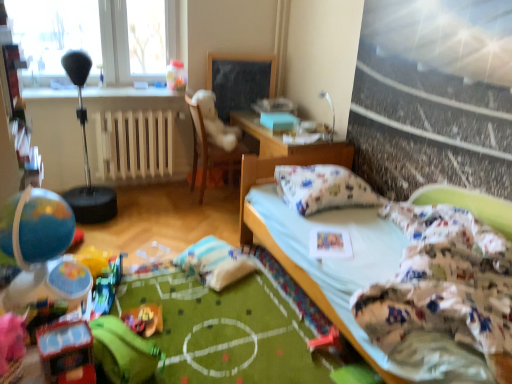
Question: Is matte plastic globe at left, which is the 4th toy from bottom to top, next to white wooden radiator at center and touching it?

Choices:
 (A) yes
 (B) no

Answer: (B)

Question: Is matte plastic globe at left, which is the 4th toy from bottom to top, positioned before white wooden radiator at center?

Choices:
 (A) yes
 (B) no

Answer: (A)

Question: Can white wooden radiator at center be found inside matte plastic globe at left, which is the 4th toy from bottom to top?

Choices:
 (A) yes
 (B) no

Answer: (B)

Question: Is matte plastic globe at left, which is the fourth toy in back-to-front order, to the left of white wooden radiator at center from the viewer's perspective?

Choices:
 (A) no
 (B) yes

Answer: (A)

Question: From a real-world perspective, is matte plastic globe at left, arranged as the second toy when viewed from the top, beneath white wooden radiator at center?

Choices:
 (A) no
 (B) yes

Answer: (A)

Question: Which is correct: translucent plastic container at upper center, which ranks as the fifth toy in front-to-back order, is inside white wooden radiator at center, or outside of it?

Choices:
 (A) inside
 (B) outside

Answer: (B)

Question: From the image's perspective, is translucent plastic container at upper center, arranged as the fourth toy when viewed from the right, positioned above or below white wooden radiator at center?

Choices:
 (A) below
 (B) above

Answer: (B)

Question: From their relative heights in the image, would you say translucent plastic container at upper center, arranged as the fourth toy when viewed from the right, is taller or shorter than white wooden radiator at center?

Choices:
 (A) short
 (B) tall

Answer: (A)

Question: Visually, is translucent plastic container at upper center, arranged as the fourth toy when viewed from the right, positioned to the left or to the right of white wooden radiator at center?

Choices:
 (A) left
 (B) right

Answer: (B)

Question: Does point (87, 355) appear closer or farther from the camera than point (246, 228)?

Choices:
 (A) closer
 (B) farther

Answer: (A)

Question: Is shiny plastic toy car at lower left, which ranks as the second toy in right-to-left order, to the left or to the right of wooden table at center in the image?

Choices:
 (A) left
 (B) right

Answer: (A)

Question: Would you say shiny plastic toy car at lower left, which is counted as the third toy, starting from the bottom, is inside or outside wooden table at center?

Choices:
 (A) outside
 (B) inside

Answer: (A)

Question: From the image's perspective, relative to wooden table at center, is shiny plastic toy car at lower left, which appears as the fourth toy when viewed from the left, above or below?

Choices:
 (A) above
 (B) below

Answer: (B)

Question: Is white wooden radiator at center taller or shorter than black chalkboard at center?

Choices:
 (A) short
 (B) tall

Answer: (A)

Question: Is point (120, 142) positioned closer to the camera than point (217, 84)?

Choices:
 (A) farther
 (B) closer

Answer: (B)